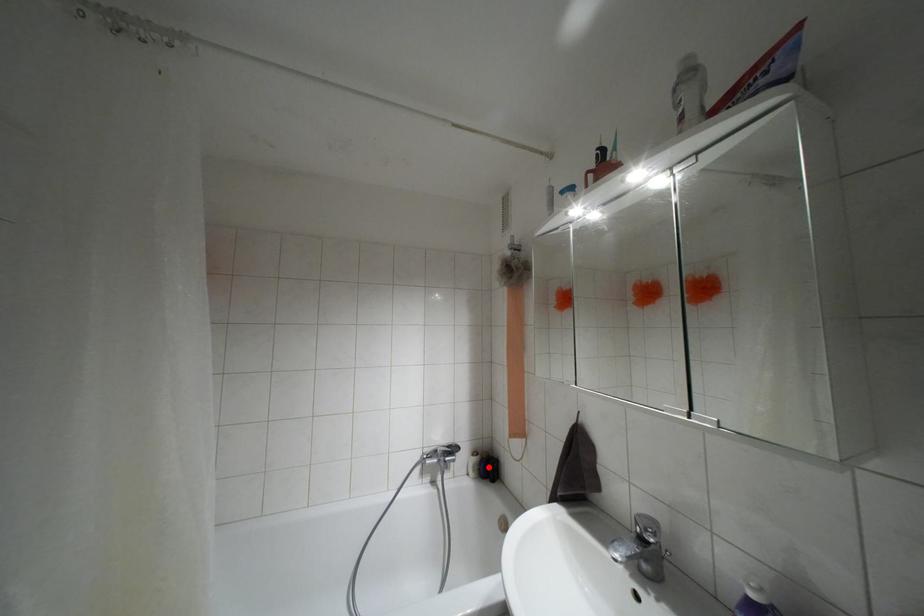
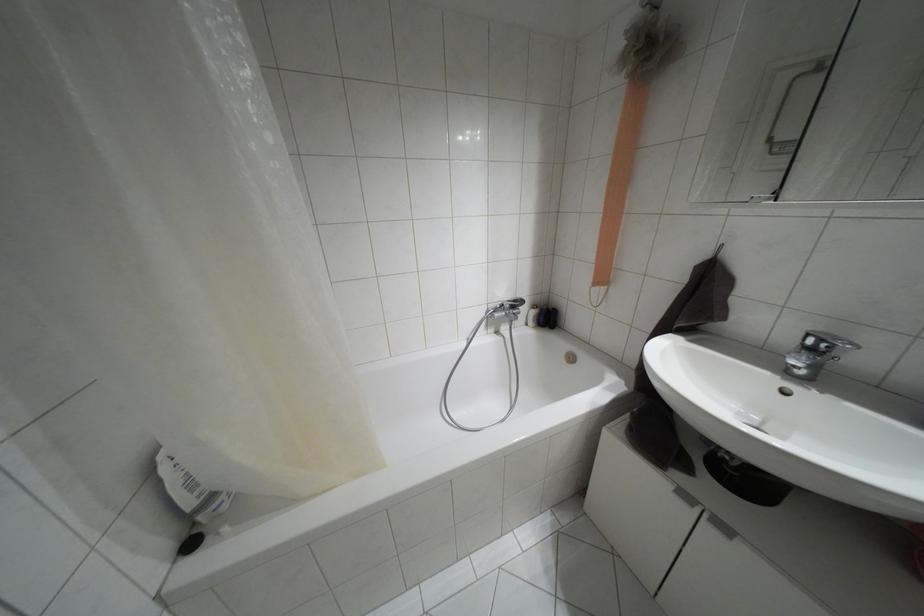
Where in the second image is the point corresponding to the highlighted location from the first image?

(546, 317)